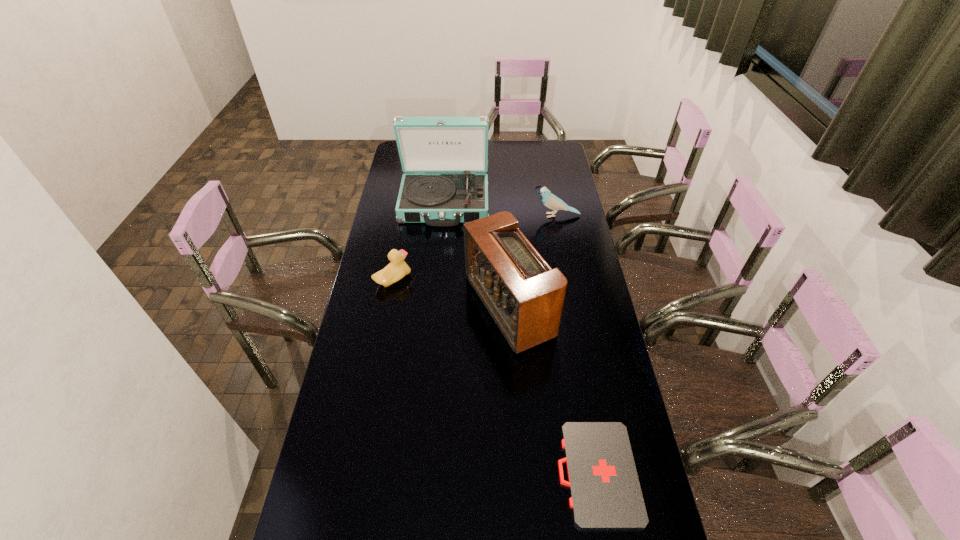
Where is `the tallest object`? the tallest object is located at coordinates (448, 149).

At what (x,y) coordinates should I click in order to perform the action: click on the fourth shortest object. Please return your answer as a coordinate pair (x, y). This screenshot has width=960, height=540. Looking at the image, I should click on (523, 294).

Find the location of a particular element. The width and height of the screenshot is (960, 540). bird is located at coordinates (551, 201).

Where is `duck`? duck is located at coordinates (397, 268).

This screenshot has height=540, width=960. In order to click on the shortest object in this screenshot , I will do `click(605, 492)`.

This screenshot has width=960, height=540. What are the coordinates of `the first-aid kit` in the screenshot? It's located at (605, 492).

You are a GUI agent. You are given a task and a screenshot of the screen. Output one action in this format:
    pyautogui.click(x=<x>, y=<y>)
    Task: Click on the vacant space positioned 0.130m on the face side of the record player
    The width and height of the screenshot is (960, 540).
    Given the screenshot: What is the action you would take?
    pyautogui.click(x=441, y=248)

Identify the location of vacant region located 0.310m on the left of the second tallest object. (378, 307).

Where is `free point located at the face of the bird`? free point located at the face of the bird is located at coordinates (505, 215).

In order to click on vacant area situated at the face of the bird in this screenshot , I will do `click(490, 215)`.